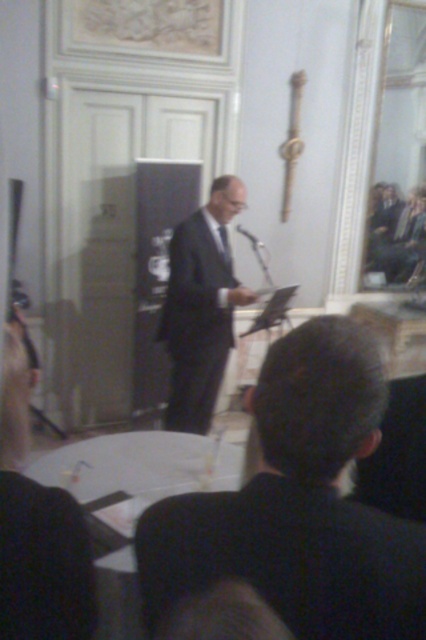
Who is positioned more to the left, matte black suit at center or black plastic microphone at center?

matte black suit at center is more to the left.

How distant is matte black suit at center from black plastic microphone at center?

matte black suit at center and black plastic microphone at center are 1.07 meters apart.

What are the coordinates of `matte black suit at center` in the screenshot? It's located at (201, 307).

Is dark suit at center to the right of matte black suit at center from the viewer's perspective?

Indeed, dark suit at center is positioned on the right side of matte black suit at center.

Between dark suit at center and matte black suit at center, which one appears on the right side from the viewer's perspective?

dark suit at center

You are a GUI agent. You are given a task and a screenshot of the screen. Output one action in this format:
    pyautogui.click(x=<x>, y=<y>)
    Task: Click on the dark suit at center
    The image size is (426, 640).
    Given the screenshot: What is the action you would take?
    pyautogui.click(x=299, y=504)

Is dark suit at center shorter than black plastic microphone at center?

No, dark suit at center is not shorter than black plastic microphone at center.

Is point (235, 528) in front of point (261, 246)?

Yes, it is.

Find the location of `dark suit at center`. dark suit at center is located at coordinates 299,504.